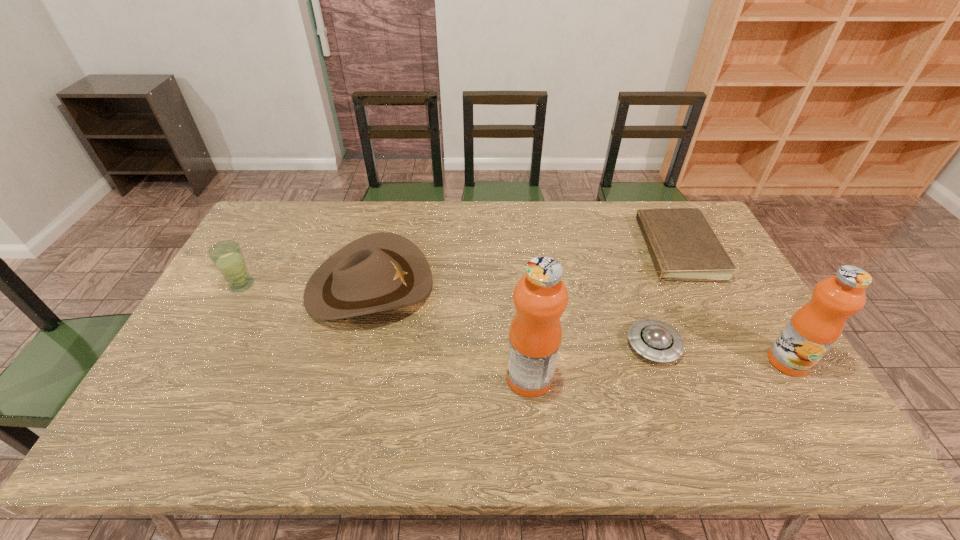
Find the location of a particular element. free spot that satisfies the following two spatial constraints: 1. on the spine side of the shorter fruit juice; 2. on the right side of the shortest object is located at coordinates (723, 361).

Locate an element on the screen. The width and height of the screenshot is (960, 540). vacant space that satisfies the following two spatial constraints: 1. with a star on the front of the second object from left to right; 2. on the right side of the saucer is located at coordinates (354, 345).

Where is `vacant space that satisfies the following two spatial constraints: 1. on the back side of the second tallest object; 2. on the left side of the fourth object from right to left`? The width and height of the screenshot is (960, 540). vacant space that satisfies the following two spatial constraints: 1. on the back side of the second tallest object; 2. on the left side of the fourth object from right to left is located at coordinates (528, 361).

The height and width of the screenshot is (540, 960). What are the coordinates of `vacant region that satisfies the following two spatial constraints: 1. with a star on the front of the cowboy hat; 2. on the back side of the right fruit juice` in the screenshot? It's located at (350, 361).